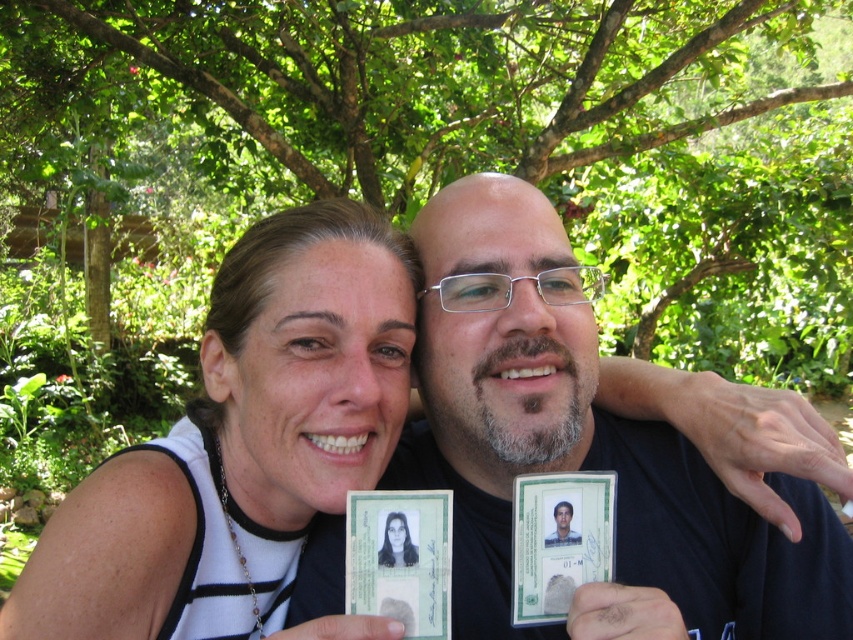
Does black matte id card at center have a smaller size compared to green plastic id card at center?

No.

Does point (788, 579) lie behind point (554, 518)?

Yes, it is behind point (554, 518).

Describe the element at coordinates (583, 448) in the screenshot. This screenshot has width=853, height=640. I see `black matte id card at center` at that location.

In order to click on black matte id card at center in this screenshot , I will do [583, 448].

Does white matte id card at center appear on the right side of green plastic id card at center?

In fact, white matte id card at center is to the left of green plastic id card at center.

Measure the distance between point (178, 438) and camera.

Point (178, 438) and camera are 37.81 inches apart.

Which is in front, point (225, 496) or point (558, 536)?

Point (558, 536)

This screenshot has width=853, height=640. Find the location of `white matte id card at center`. white matte id card at center is located at coordinates (241, 444).

Is smooth black id card at center above green plastic id card at center?

No.

Which is more to the right, smooth black id card at center or green plastic id card at center?

green plastic id card at center

Who is more distant from viewer, [387,531] or [544,545]?

Point [544,545]

In order to click on smooth black id card at center in this screenshot , I will do `click(396, 541)`.